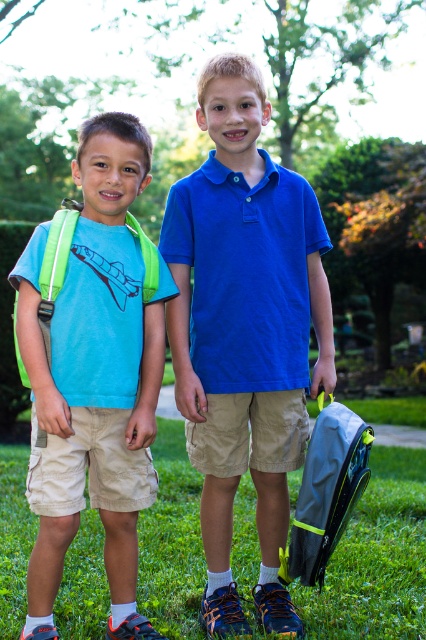
You are trying to decide whether to place a new item between the matte green backpack at left and the green grass at lower center. Considering their sizes, which object should you place the item closer to if you want it to be less noticeable?

The matte green backpack at left is larger in size than the green grass at lower center. To make the new item less noticeable, place it closer to the matte green backpack at left since its larger size can help blend the item better.

You are a photographer trying to capture a photo of the two boys in the scene. You notice the matte green backpack at left and the green grass at lower center. Which object is narrower in width?

The matte green backpack at left has a lesser width compared to the green grass at lower center, so the matte green backpack at left is narrower in width.